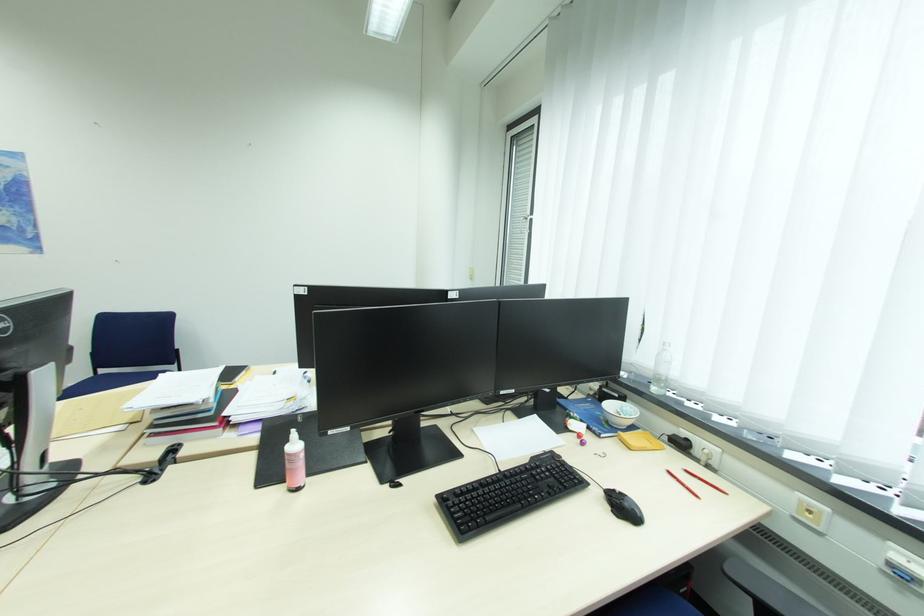
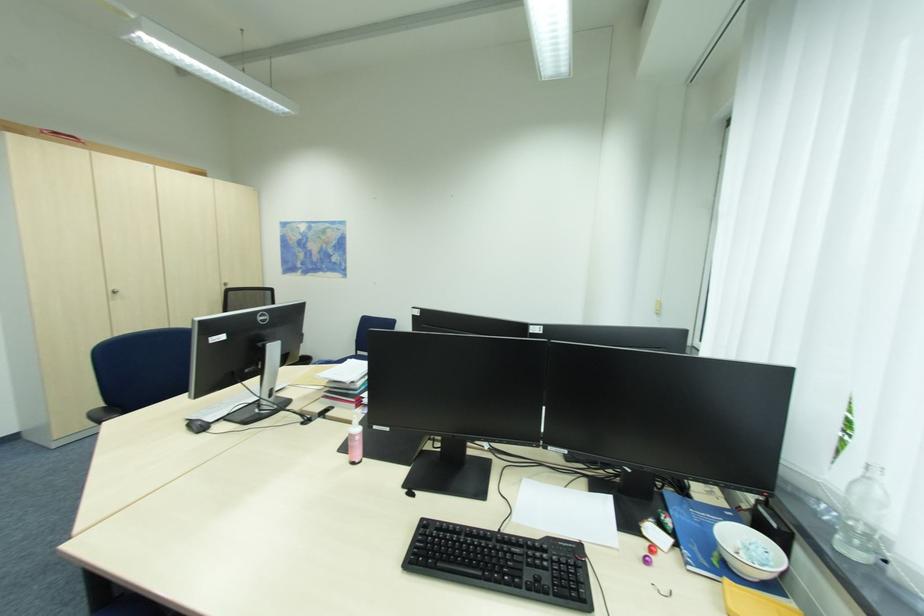
Question: The images are taken continuously from a first-person perspective. In which direction is your viewpoint rotating?

Choices:
 (A) Left
 (B) Right
 (C) Up
 (D) Down

Answer: (A)